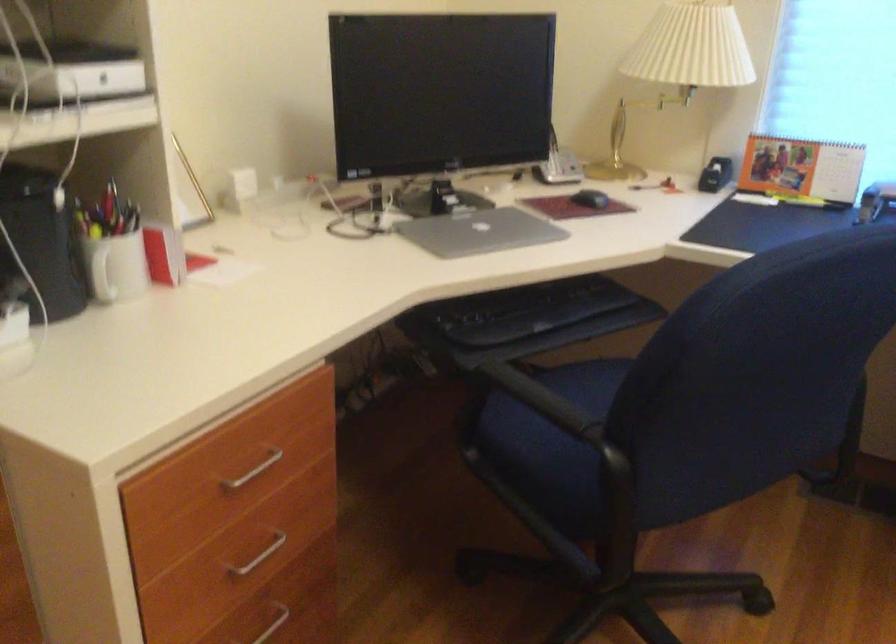
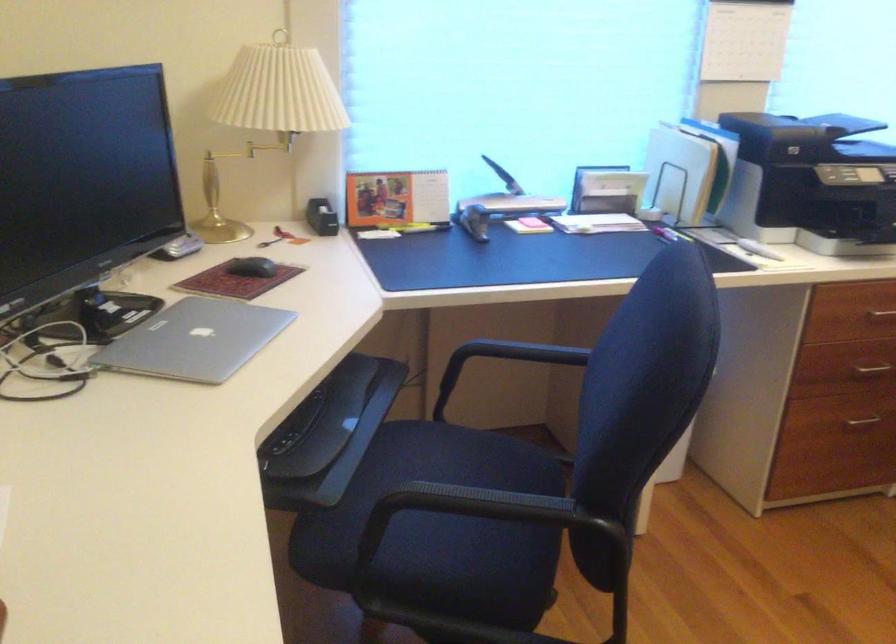
Question: The camera is either moving clockwise (left) or counter-clockwise (right) around the object. The first image is from the beginning of the video and the second image is from the end. Is the camera moving left or right when shooting the video?

Choices:
 (A) Left
 (B) Right

Answer: (A)